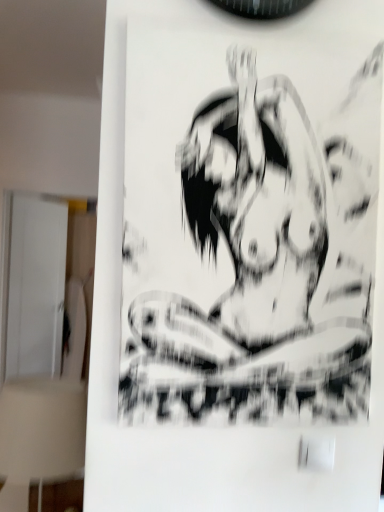
What do you see at coordinates (245, 238) in the screenshot? I see `black matte poster at center` at bounding box center [245, 238].

In order to face black matte poster at center, should I rotate leftwards or rightwards?

You should look right and rotate roughly 7.783 degrees.

This screenshot has width=384, height=512. Find the location of `black matte poster at center`. black matte poster at center is located at coordinates (245, 238).

Image resolution: width=384 pixels, height=512 pixels. In order to click on black matte poster at center in this screenshot , I will do `click(245, 238)`.